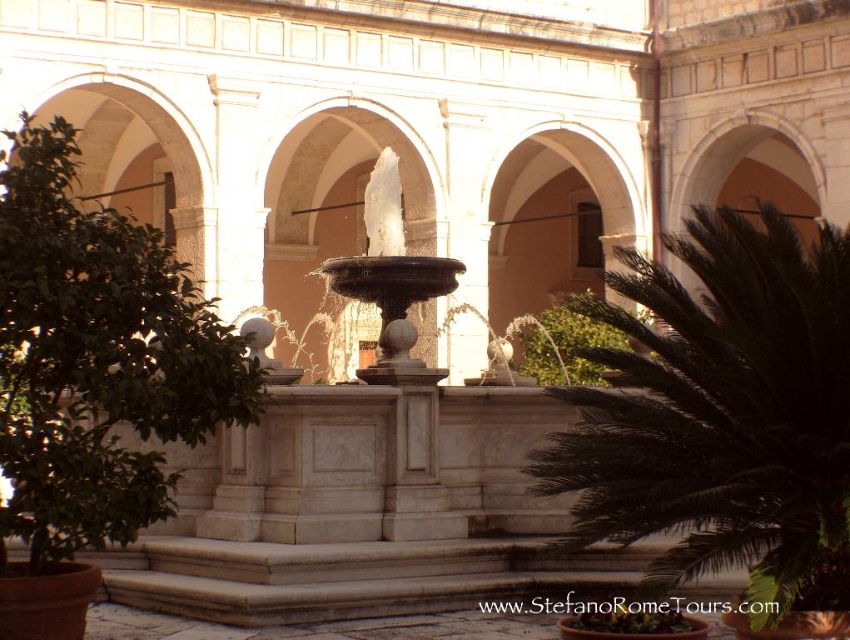
You are standing at the center of the courtyard facing the fountain. Which direction should you walk to reach the green leafy tree at left?

The green leafy tree at left is located to your left side, so you should walk to your left to reach it.

You are standing in the courtyard and want to place a bench between the dark green leafy palm at right and the green leafy plant at center. Which side of the bench should face the wider plant?

The dark green leafy palm at right might be wider than green leafy plant at center, so the bench should face the dark green leafy palm at right if you want it to be closer to the wider plant.